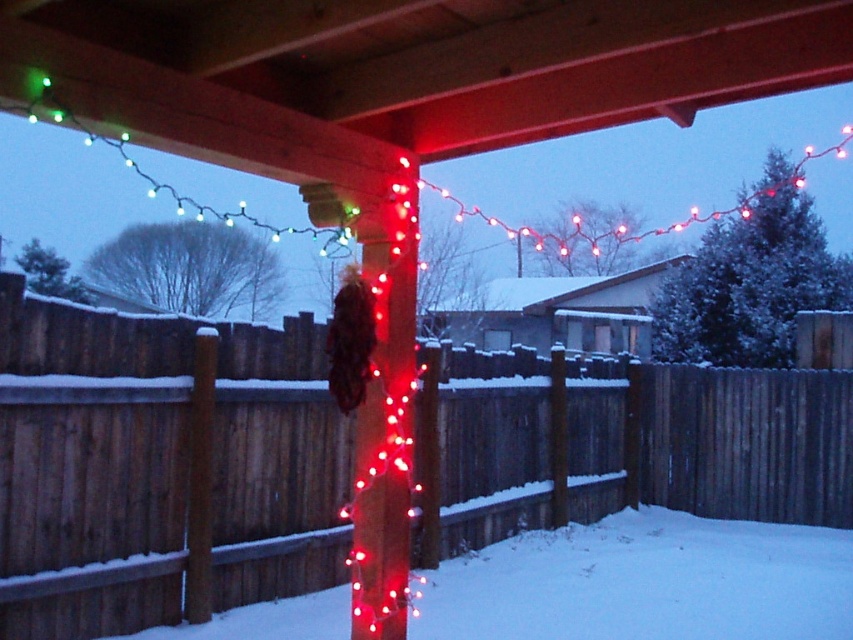
Question: Which point is farther to the camera?

Choices:
 (A) wooden fence at center
 (B) white powdery snow at center

Answer: (B)

Question: Among these objects, which one is farthest from the camera?

Choices:
 (A) wooden fence at center
 (B) white powdery snow at center

Answer: (B)

Question: In this image, where is wooden fence at center located relative to white powdery snow at center?

Choices:
 (A) above
 (B) below

Answer: (A)

Question: Can you confirm if wooden fence at center is positioned to the left of white powdery snow at center?

Choices:
 (A) no
 (B) yes

Answer: (B)

Question: Considering the relative positions of wooden fence at center and white powdery snow at center in the image provided, where is wooden fence at center located with respect to white powdery snow at center?

Choices:
 (A) left
 (B) right

Answer: (A)